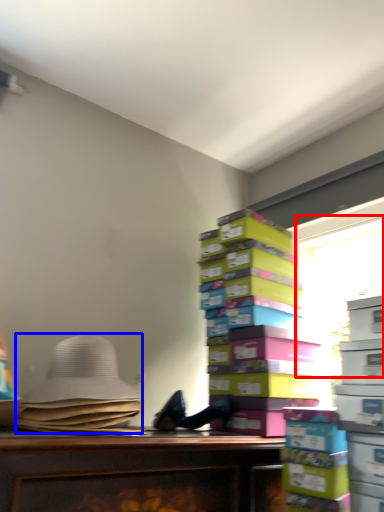
Question: Which object appears closest to the camera in this image, window screen (highlighted by a red box) or wide (highlighted by a blue box)?

Choices:
 (A) window screen
 (B) wide

Answer: (B)